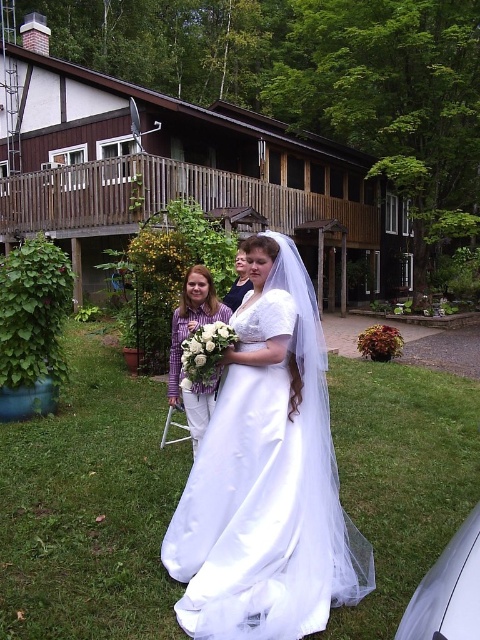
Does white satin dress at center have a smaller size compared to purple striped shirt at center?

Actually, white satin dress at center might be larger than purple striped shirt at center.

Where is `white satin dress at center`? The height and width of the screenshot is (640, 480). white satin dress at center is located at coordinates (267, 476).